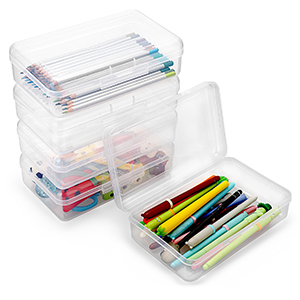
Find the location of a particular element. This screenshot has width=300, height=300. containers is located at coordinates (72, 87), (73, 134), (75, 169), (78, 197), (177, 217).